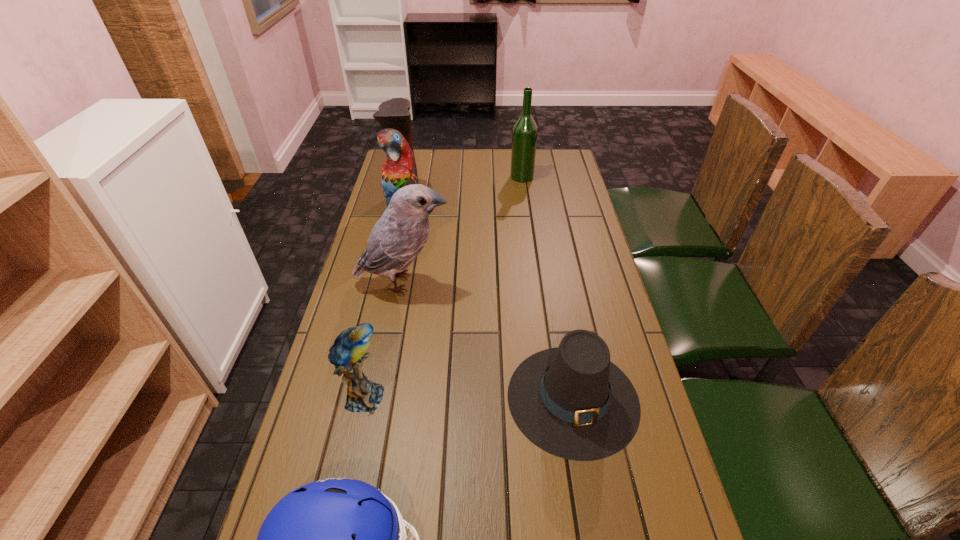
You are a GUI agent. You are given a task and a screenshot of the screen. Output one action in this format:
    pyautogui.click(x=<x>, y=<y>)
    Task: Click on the farthest parrot
    
    Given the screenshot: What is the action you would take?
    pyautogui.click(x=399, y=170)

Image resolution: width=960 pixels, height=540 pixels. Find the location of `the farthest object`. the farthest object is located at coordinates (524, 136).

Locate an element on the screen. The width and height of the screenshot is (960, 540). the third farthest object is located at coordinates (397, 238).

Locate an element on the screen. Image resolution: width=960 pixels, height=540 pixels. the nearest parrot is located at coordinates (347, 354).

Find the location of a particular element. This screenshot has height=540, width=960. the shortest parrot is located at coordinates (347, 354).

The height and width of the screenshot is (540, 960). What are the coordinates of `the shortest object` in the screenshot? It's located at (571, 401).

The width and height of the screenshot is (960, 540). What are the coordinates of `vacant space positioned 0.070m at the face of the fifth nearest object` in the screenshot? It's located at (440, 206).

Image resolution: width=960 pixels, height=540 pixels. Identify the location of vacant space located on the left of the alcohol. (466, 177).

Identify the location of vacant space located on the front-facing side of the third farthest object. This screenshot has height=540, width=960. (502, 283).

Where is `free region located 0.340m on the face of the fourth tallest object`? Image resolution: width=960 pixels, height=540 pixels. free region located 0.340m on the face of the fourth tallest object is located at coordinates click(x=534, y=397).